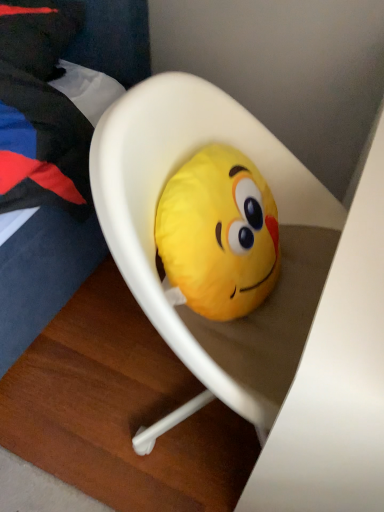
Question: Can you confirm if soft yellow plush at center is thinner than white plastic chair at center?

Choices:
 (A) no
 (B) yes

Answer: (B)

Question: Is soft yellow plush at center next to white plastic chair at center?

Choices:
 (A) yes
 (B) no

Answer: (A)

Question: From a real-world perspective, is soft yellow plush at center over white plastic chair at center?

Choices:
 (A) yes
 (B) no

Answer: (A)

Question: Is soft yellow plush at center at the left side of white plastic chair at center?

Choices:
 (A) yes
 (B) no

Answer: (A)

Question: Are soft yellow plush at center and white plastic chair at center far apart?

Choices:
 (A) yes
 (B) no

Answer: (B)

Question: Is soft yellow plush at center wider than white plastic chair at center?

Choices:
 (A) no
 (B) yes

Answer: (A)

Question: Considering the relative positions of white plastic chair at center and soft yellow plush at center in the image provided, is white plastic chair at center behind soft yellow plush at center?

Choices:
 (A) no
 (B) yes

Answer: (A)

Question: Is soft yellow plush at center at the back of white plastic chair at center?

Choices:
 (A) no
 (B) yes

Answer: (B)

Question: Can you confirm if white plastic chair at center is thinner than soft yellow plush at center?

Choices:
 (A) no
 (B) yes

Answer: (A)

Question: From the image's perspective, is white plastic chair at center over soft yellow plush at center?

Choices:
 (A) no
 (B) yes

Answer: (A)

Question: Can you confirm if white plastic chair at center is positioned to the left of soft yellow plush at center?

Choices:
 (A) no
 (B) yes

Answer: (A)

Question: Is white plastic chair at center shorter than soft yellow plush at center?

Choices:
 (A) yes
 (B) no

Answer: (B)

Question: Is white plastic chair at center bigger or smaller than soft yellow plush at center?

Choices:
 (A) small
 (B) big

Answer: (B)